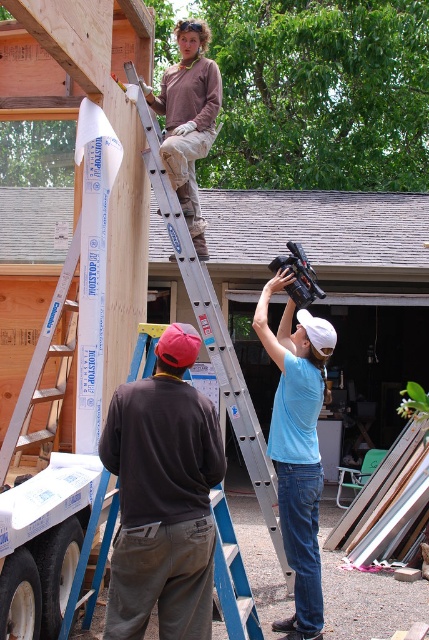
Question: In this image, where is gray shingles at upper center located relative to light blue t-shirt at upper center?

Choices:
 (A) below
 (B) above

Answer: (B)

Question: Which point appears closest to the camera in this image?

Choices:
 (A) [289, 570]
 (B) [357, 211]
 (C) [154, 513]
 (D) [263, 333]

Answer: (C)

Question: Which object is farther from the camera taking this photo?

Choices:
 (A) light blue t-shirt at upper center
 (B) dark gray sweatshirt at lower left
 (C) matte brown shirt at upper center
 (D) gray shingles at upper center

Answer: (D)

Question: In this image, where is dark gray sweatshirt at lower left located relative to matte brown shirt at upper center?

Choices:
 (A) below
 (B) above

Answer: (A)

Question: Does dark gray sweatshirt at lower left have a greater width compared to silver metallic ladder at upper center?

Choices:
 (A) no
 (B) yes

Answer: (A)

Question: Which point is closer to the camera taking this photo?

Choices:
 (A) (193, 83)
 (B) (304, 365)

Answer: (B)